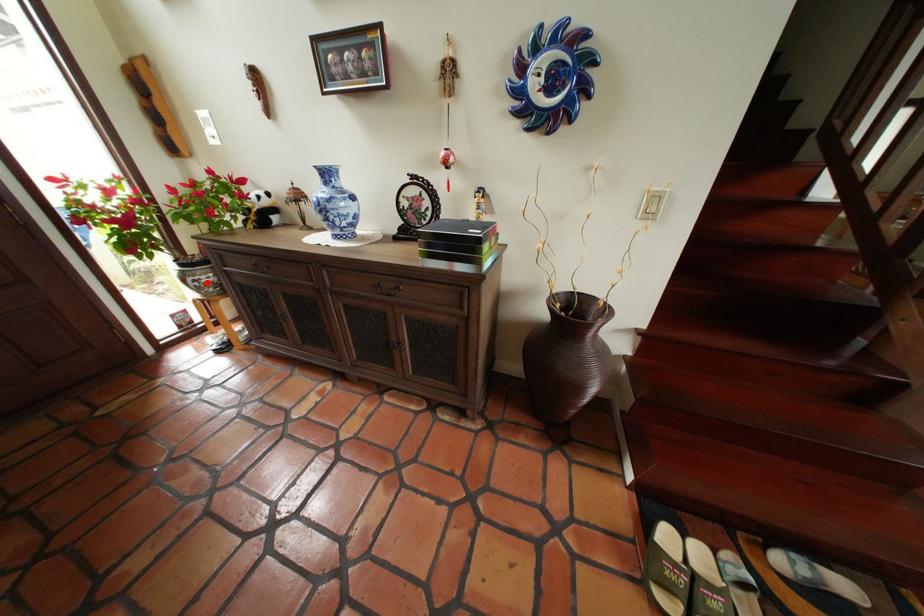
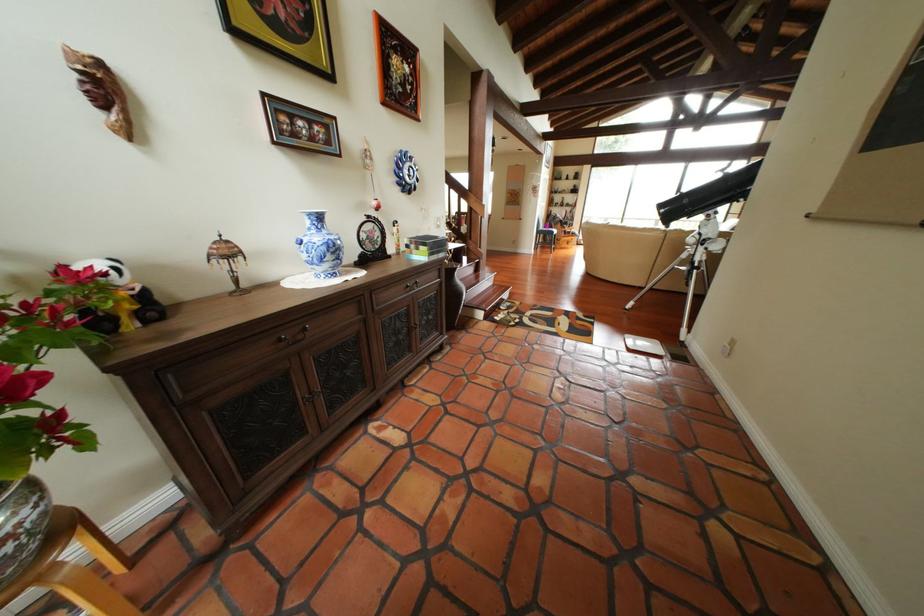
Find the pixel in the second image that matches the highlighted location in the first image.

(11, 546)